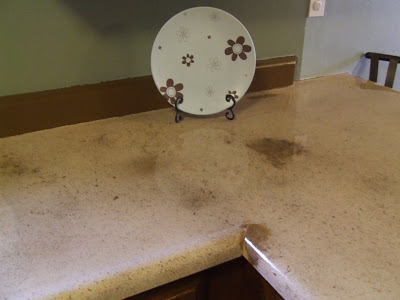
This screenshot has height=300, width=400. In order to click on plate stand in this screenshot , I will do [176, 117], [178, 98], [228, 96], [231, 118].